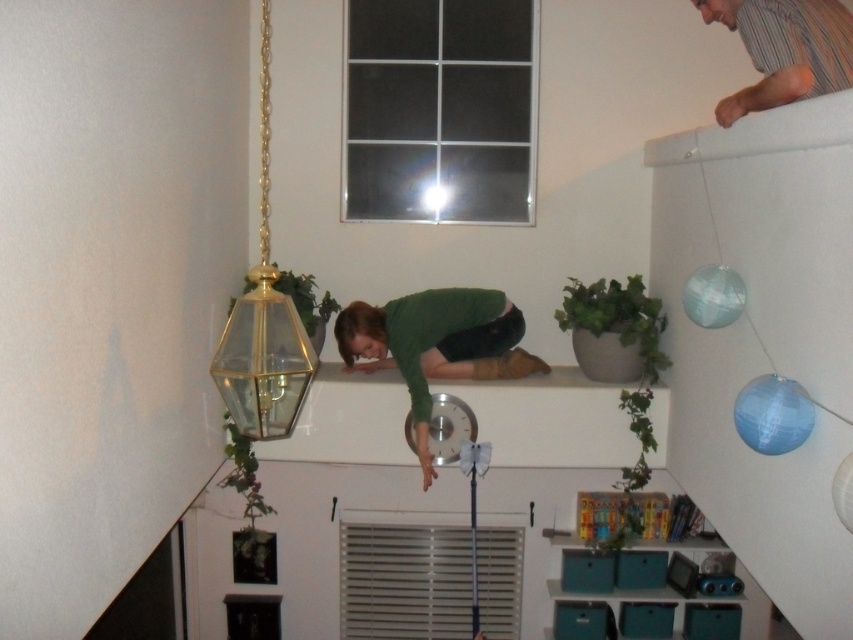
You are standing in the room looking up and see the clear glass pendant light at upper left. Where exactly is it positioned relative to the window with six panes?

The clear glass pendant light at upper left is located at coordinates point 0.502 on the x axis and 0.309 on the y axis.

You are standing in the room and want to hang a picture frame exactly where the clear glass pendant light at upper left is currently located. What coordinates should you use to place the frame?

The coordinates for the clear glass pendant light at upper left are at point (263, 321), so you should place the frame at those coordinates.

You are an interior designer assessing the room layout. You notice the clear glass pendant light at upper left and the green leafy plant at upper center. Which object occupies more visual space in the image?

The clear glass pendant light at upper left is larger in size than the green leafy plant at upper center, so it occupies more visual space in the image.